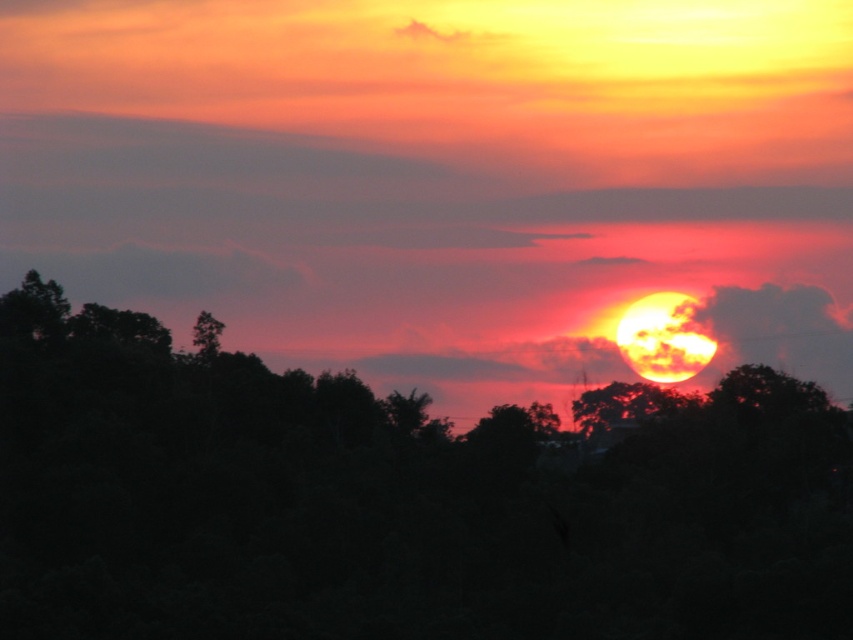
Question: Among these objects, which one is farthest from the camera?

Choices:
 (A) silhouette tree at center
 (B) green leafy tree at upper left

Answer: (B)

Question: Which point appears closest to the camera in this image?

Choices:
 (A) (769, 625)
 (B) (210, 323)

Answer: (A)

Question: Which object is closer to the camera taking this photo?

Choices:
 (A) silhouette tree at center
 (B) green leafy tree at upper left

Answer: (A)

Question: Can you confirm if silhouette tree at center is positioned below green leafy tree at upper left?

Choices:
 (A) no
 (B) yes

Answer: (B)

Question: Is silhouette tree at center to the right of green leafy tree at upper left from the viewer's perspective?

Choices:
 (A) yes
 (B) no

Answer: (A)

Question: Is the position of silhouette tree at center less distant than that of green leafy tree at upper left?

Choices:
 (A) no
 (B) yes

Answer: (B)